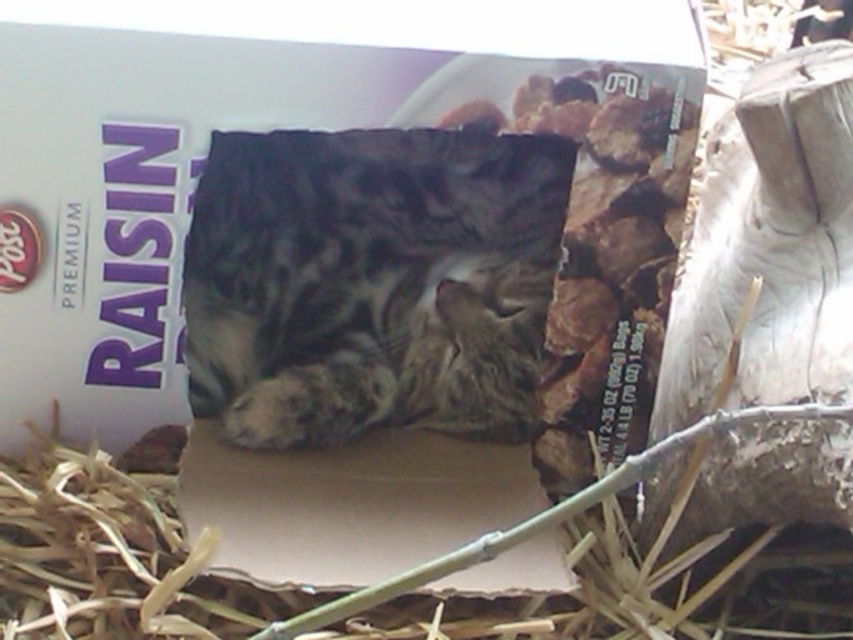
You are a veterinarian examining an image of a cat in a cardboard box. The cat has gray fur and is surrounded by brown straw. Based on the image, which object is thinner between the gray fur cat at center and the brown straw at lower center?

The gray fur cat at center is thinner than the brown straw at lower center according to the description.

You are a delivery person who needs to pack this cat into a smaller box. Given the current arrangement with the brown cardboard at center and brown straw at lower center, which item should you remove to free up more space?

The brown straw at lower center occupies more space than the brown cardboard at center, so removing the brown straw at lower center would free up more space.

You are a photographer taking a picture of the cat in the cardboard box. You notice two points marked in the scene. One is at point (434, 253) and the other at point (360, 552). Which point is closer to the camera?

Point (360, 552) is closer to the camera than point (434, 253).